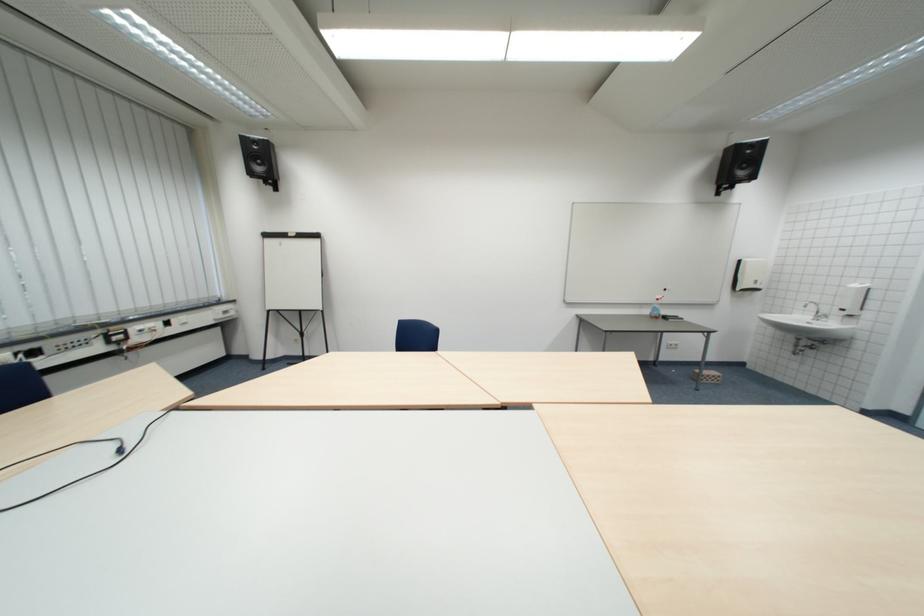
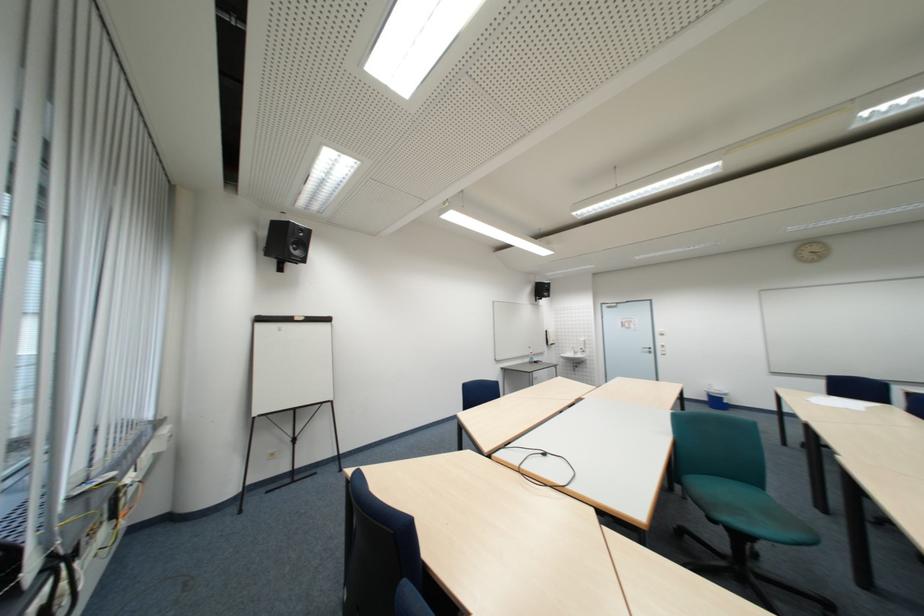
The point at (x=281, y=237) is marked in the first image. Where is the corresponding point in the second image?

(273, 321)